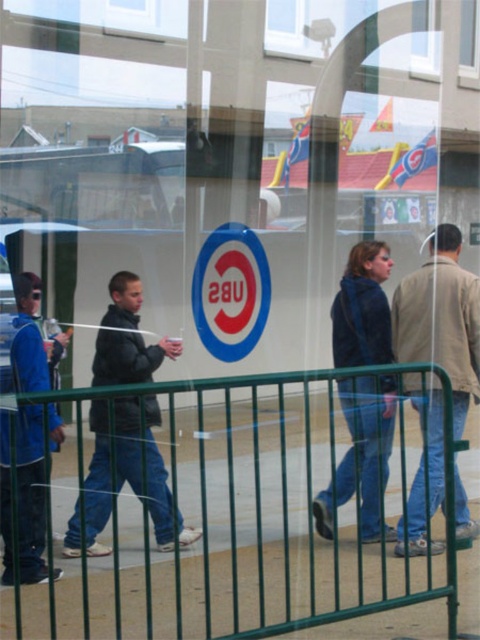
Question: Can you confirm if tan leather jacket at center is smaller than clear glass window at upper right?

Choices:
 (A) yes
 (B) no

Answer: (B)

Question: Which object is farther from the camera taking this photo?

Choices:
 (A) dark blue jacket at center
 (B) tan leather jacket at center
 (C) clear glass window at upper right
 (D) matte blue jacket at left

Answer: (C)

Question: Which object is positioned farthest from the tan leather jacket at center?

Choices:
 (A) matte blue jacket at left
 (B) green metal fence at lower center

Answer: (A)

Question: Does matte blue jacket at left appear on the right side of clear glass window at upper right?

Choices:
 (A) yes
 (B) no

Answer: (B)

Question: Does black matte jacket at left appear under matte blue jacket at left?

Choices:
 (A) yes
 (B) no

Answer: (B)

Question: Which object is the farthest from the green metal fence at lower center?

Choices:
 (A) dark blue jacket at center
 (B) tan leather jacket at center

Answer: (B)